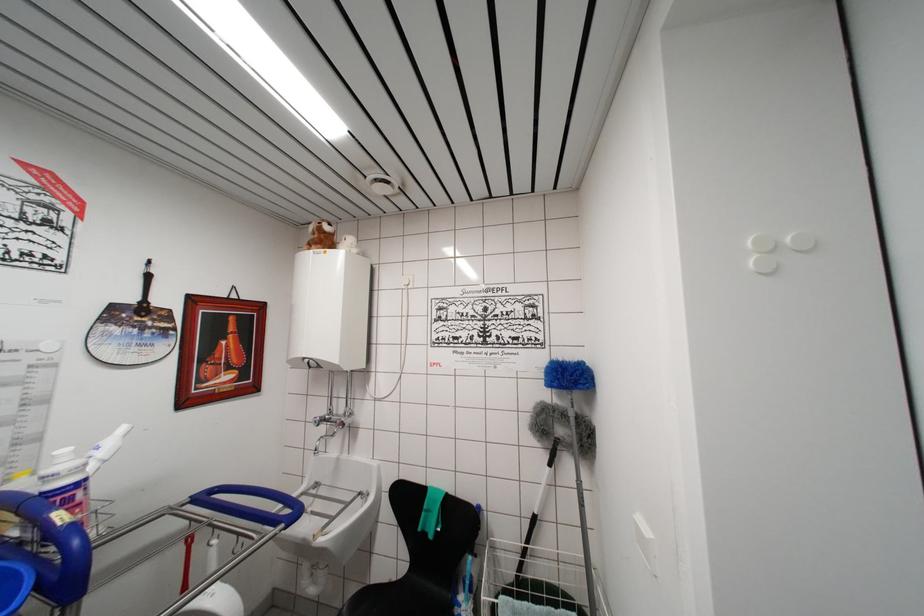
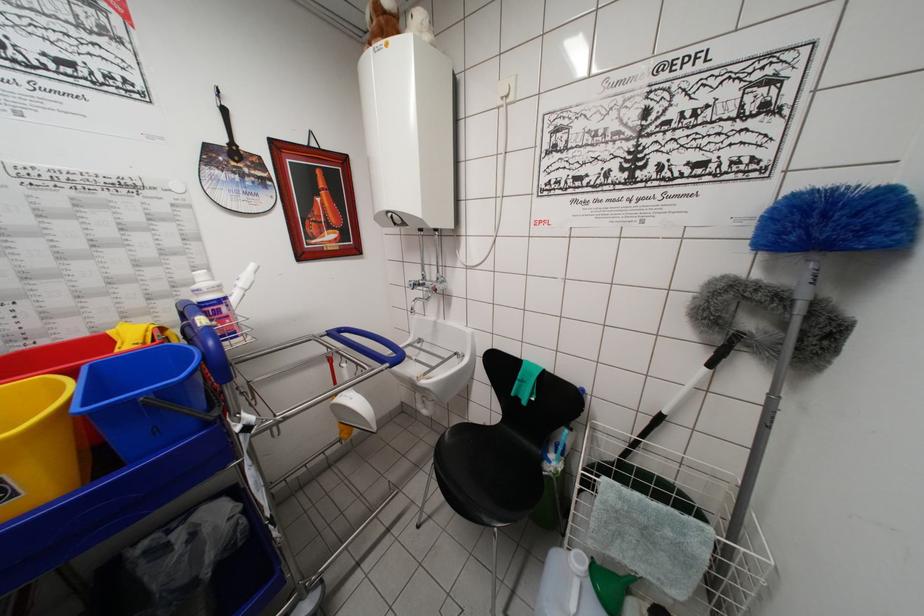
Where in the second image is the point corresponding to [350,426] from the first image?

(443, 292)